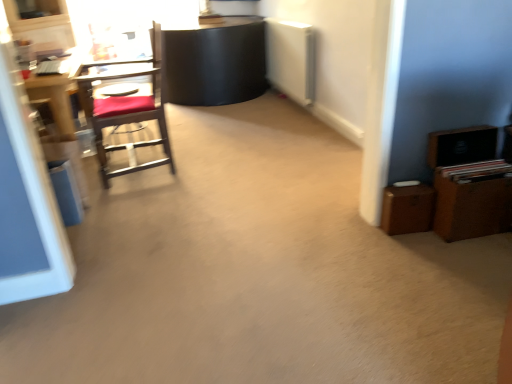
Locate an element on the screen. The width and height of the screenshot is (512, 384). vacant space in front of wooden chair with red cushion at left is located at coordinates point(149,206).